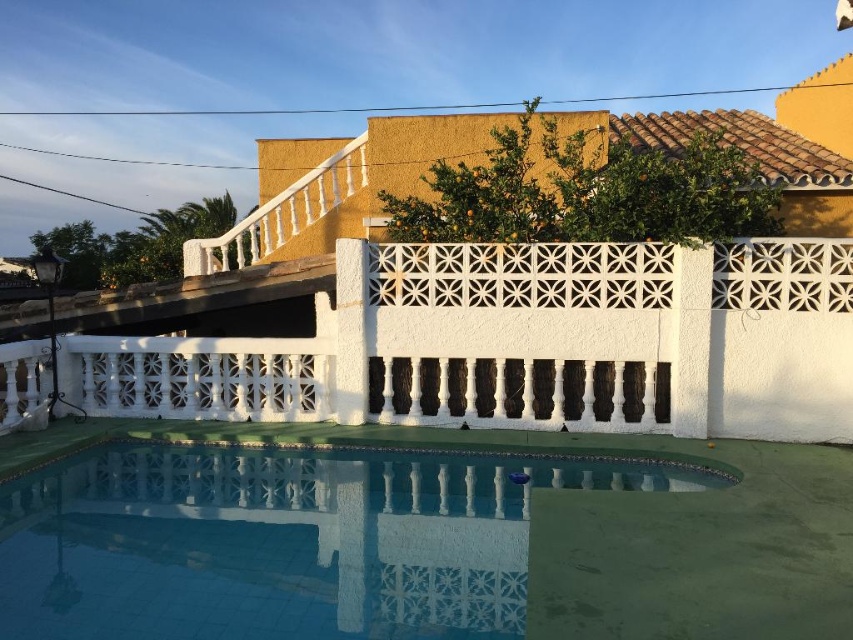
You are standing at the edge of the blue tile swimming pool at lower center and want to reach the yellow stucco villa at upper center. If your walking speed is 1.2 meters per second, how many seconds will it take you to walk directly to the villa?

The distance between the yellow stucco villa at upper center and the blue tile swimming pool at lower center is 4.85 meters. At a speed of 1.2 meters per second, it would take approximately 4.04 seconds to walk directly to the villa.

You are standing at the edge of the blue tile swimming pool at lower center and want to take a photo of the yellow stucco villa at upper center. Which direction should you face to capture the villa in your shot?

You should face to the right side to capture the yellow stucco villa at upper center since it is positioned on the right side of the blue tile swimming pool at lower center.

You are planning to install a new fence along the property line that runs between the yellow stucco villa at upper center and the blue tile swimming pool at lower center. Considering their widths, which structure would require a longer fence segment to fully enclose it?

The yellow stucco villa at upper center has a greater width than the blue tile swimming pool at lower center, so the fence segment needed to enclose it would be longer.